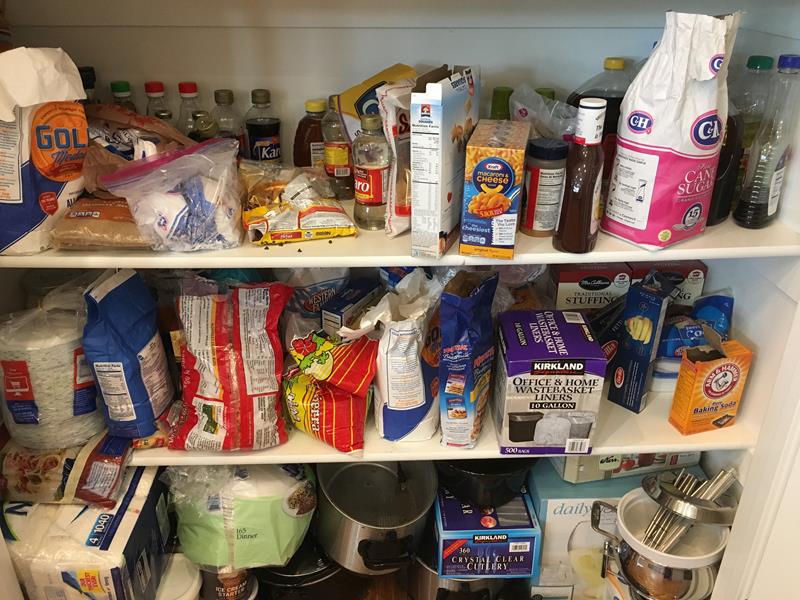
Locate an element on the screen. The width and height of the screenshot is (800, 600). paper plates is located at coordinates (42, 375).